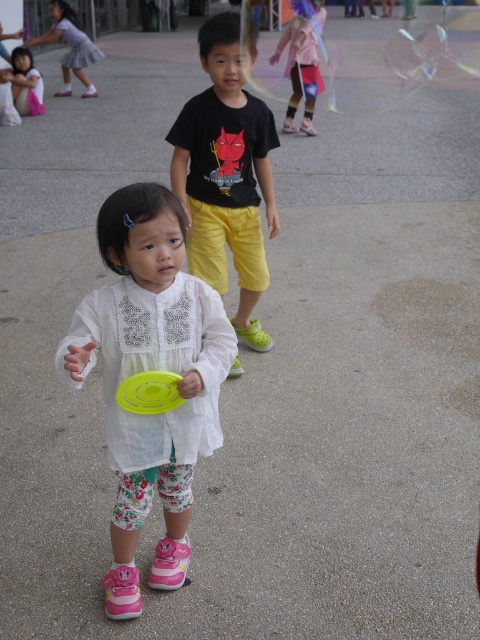
Describe the element at coordinates (151, 369) in the screenshot. This screenshot has height=640, width=480. I see `white floral leggings at center` at that location.

Can you confirm if white floral leggings at center is bigger than pink fabric dress at upper center?

No.

In order to click on white floral leggings at center in this screenshot , I will do `click(151, 369)`.

Is matte black t-shirt at upper center shorter than matte white blouse at center?

Incorrect, matte black t-shirt at upper center's height does not fall short of matte white blouse at center's.

Is point (227, 52) farther from viewer compared to point (13, 93)?

That is False.

Locate an element on the screen. This screenshot has width=480, height=640. matte black t-shirt at upper center is located at coordinates 226,173.

Does point (69, 70) come behind point (19, 97)?

Yes, it is behind point (19, 97).

Measure the distance between point (85, 56) and camera.

66.16 feet

Where is `matte pink skirt at upper left`? This screenshot has width=480, height=640. matte pink skirt at upper left is located at coordinates (70, 45).